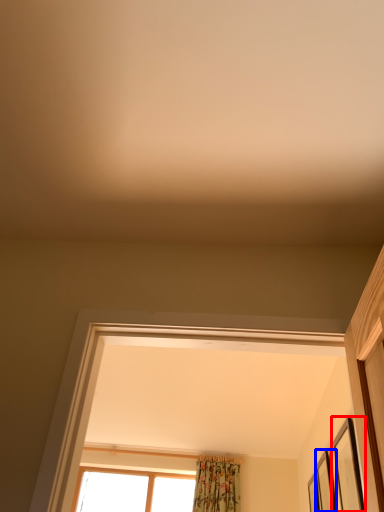
Question: Which point is further to the camera, picture frame (highlighted by a red box) or picture frame (highlighted by a blue box)?

Choices:
 (A) picture frame
 (B) picture frame

Answer: (B)